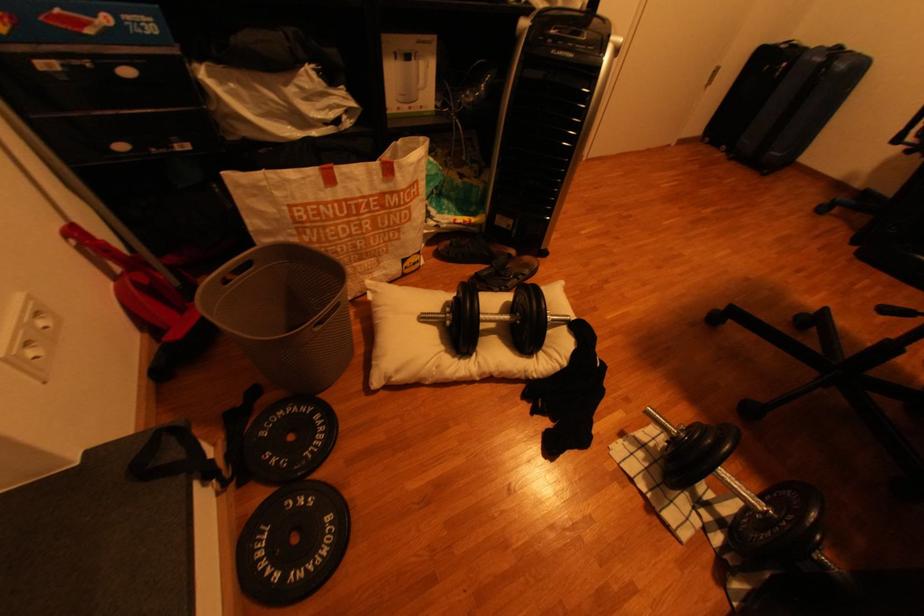
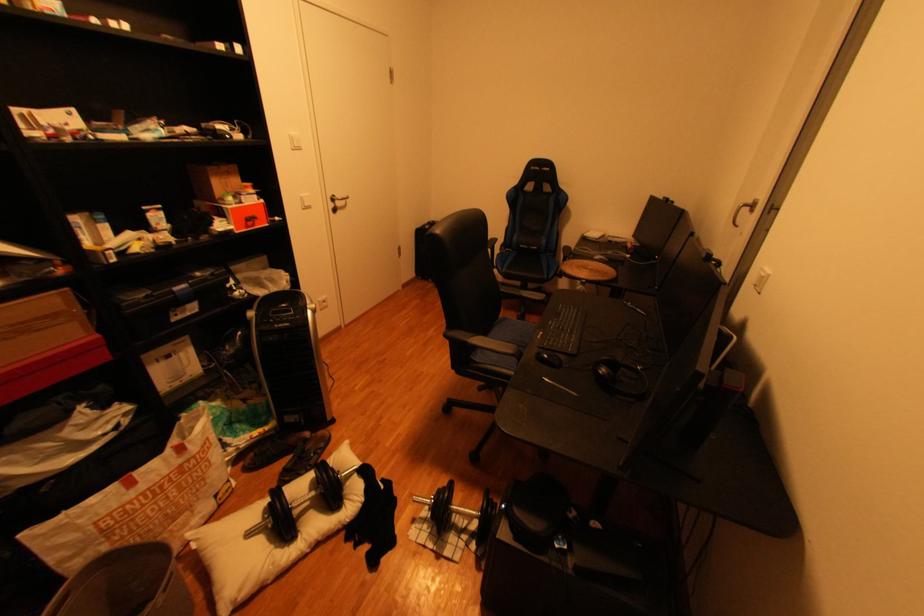
Where in the second image is the point corresponding to pixel 513 288 from the first image?

(318, 468)